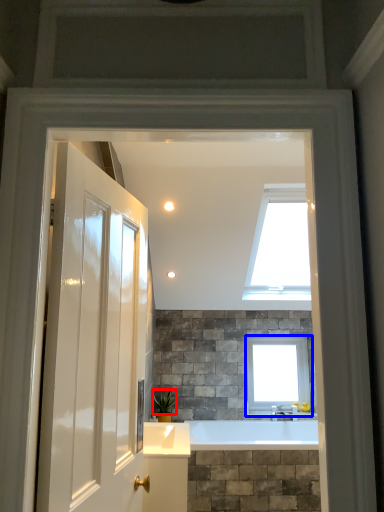
Question: Among these objects, which one is nearest to the camera, plant (highlighted by a red box) or window (highlighted by a blue box)?

Choices:
 (A) plant
 (B) window

Answer: (A)